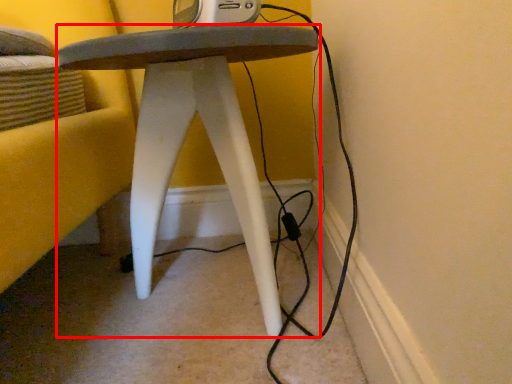
Question: In this image, where is stool (annotated by the red box) located relative to gadget?

Choices:
 (A) right
 (B) left

Answer: (B)